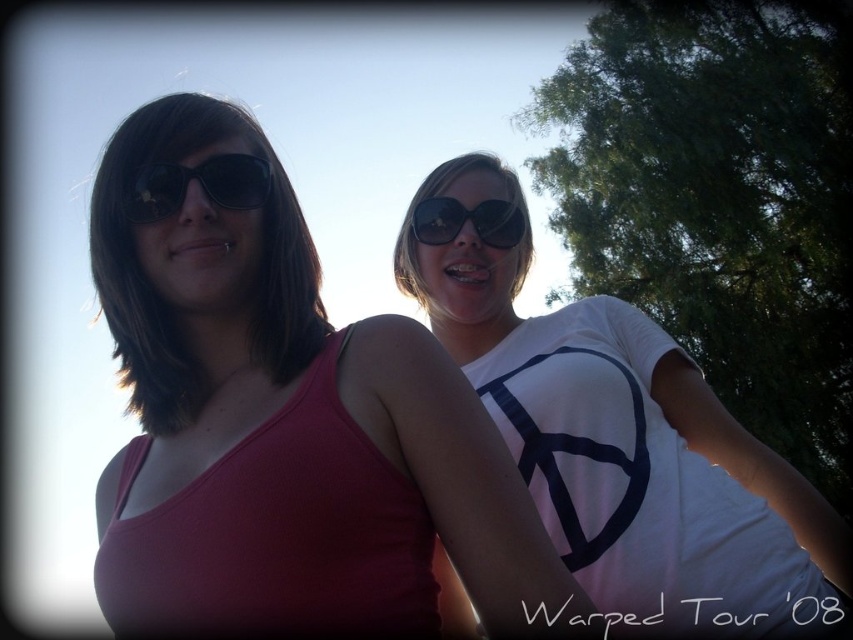
Can you confirm if matte black tank top at left is thinner than black reflective sunglasses at center?

In fact, matte black tank top at left might be wider than black reflective sunglasses at center.

Describe the element at coordinates (286, 424) in the screenshot. This screenshot has height=640, width=853. I see `matte black tank top at left` at that location.

Where is `matte black tank top at left`? The height and width of the screenshot is (640, 853). matte black tank top at left is located at coordinates (286, 424).

Can you confirm if green leafy tree at upper right is positioned below black reflective sunglasses at center?

Incorrect, green leafy tree at upper right is not positioned below black reflective sunglasses at center.

Based on the photo, measure the distance between green leafy tree at upper right and camera.

The distance of green leafy tree at upper right from camera is 11.03 meters.

At what (x,y) coordinates should I click in order to perform the action: click on green leafy tree at upper right. Please return your answer as a coordinate pair (x, y). This screenshot has width=853, height=640. Looking at the image, I should click on (718, 198).

Which is behind, point (833, 381) or point (248, 166)?

The point (833, 381) is behind.

Is point (827, 248) behind point (253, 193)?

Yes, it is.

Find the location of a particular element. The image size is (853, 640). green leafy tree at upper right is located at coordinates (718, 198).